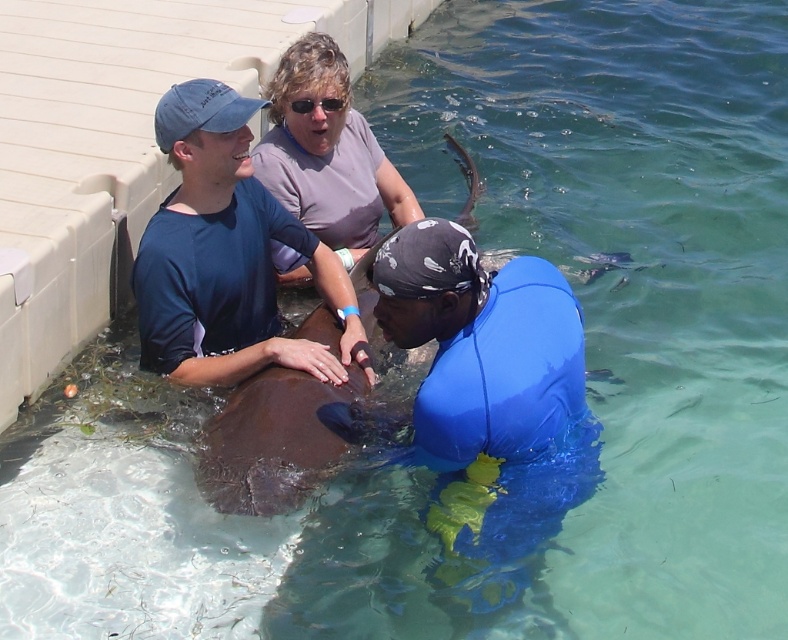
Question: Can you confirm if blue matte wetsuit at lower right is wider than purple matte shirt at upper center?

Choices:
 (A) yes
 (B) no

Answer: (A)

Question: Which point is farther to the camera?

Choices:
 (A) click(519, 348)
 (B) click(337, 51)

Answer: (B)

Question: Is blue matte wetsuit at lower right thinner than blue matte shirt at upper left?

Choices:
 (A) no
 (B) yes

Answer: (B)

Question: Which object is farther from the camera taking this photo?

Choices:
 (A) blue matte shirt at upper left
 (B) purple matte shirt at upper center
 (C) blue matte wetsuit at lower right

Answer: (B)

Question: Can you confirm if blue matte shirt at upper left is wider than purple matte shirt at upper center?

Choices:
 (A) yes
 (B) no

Answer: (A)

Question: Among these objects, which one is nearest to the camera?

Choices:
 (A) purple matte shirt at upper center
 (B) blue matte shirt at upper left

Answer: (B)